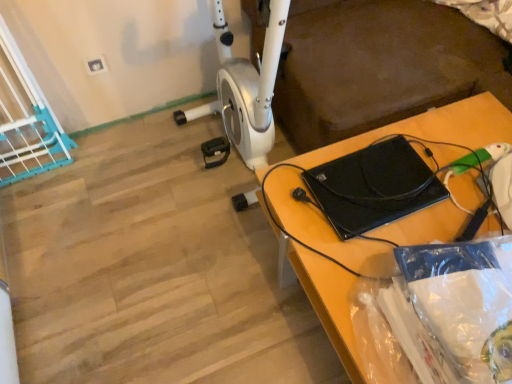
I want to click on free point above black matte laptop at right (from a real-world perspective), so click(410, 201).